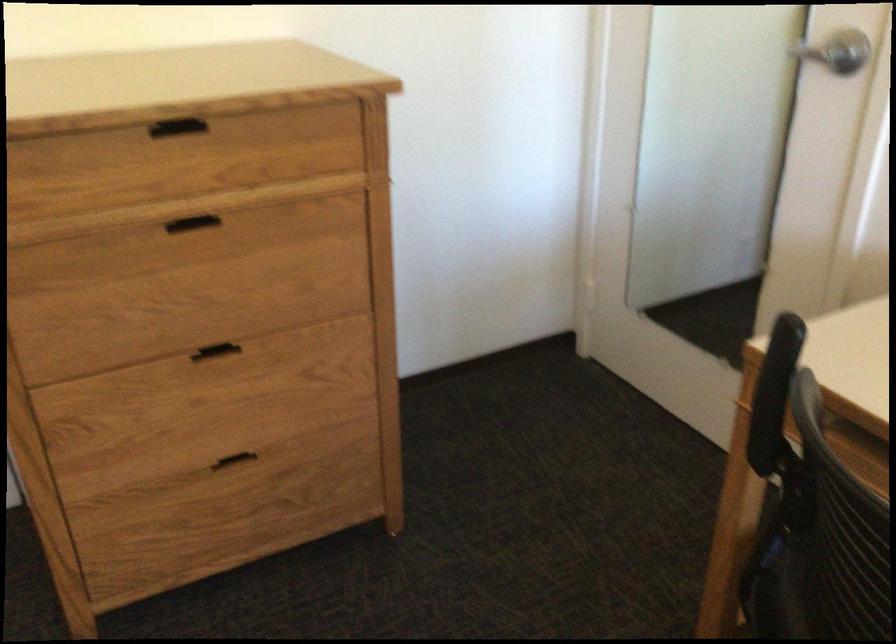
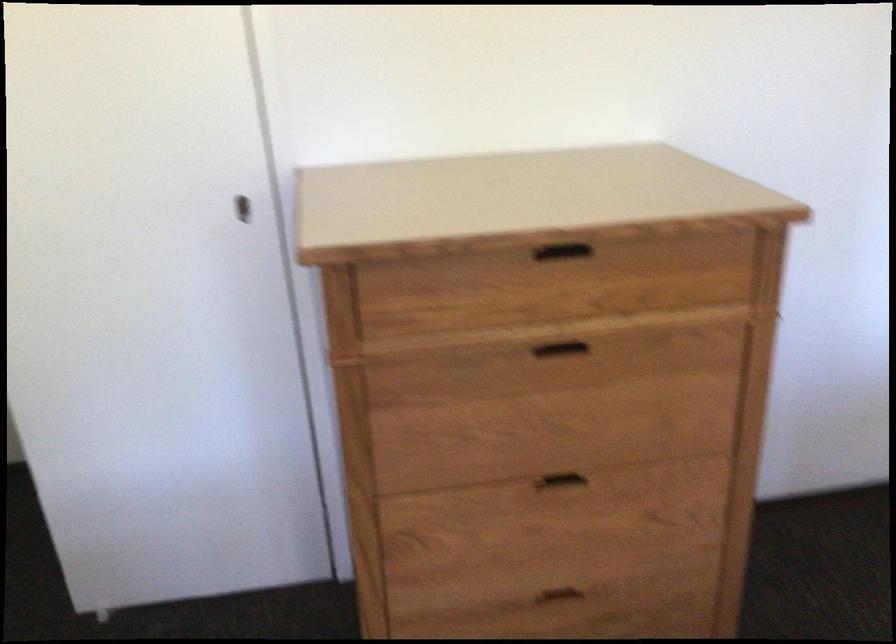
Based on the photo, in a continuous first-person perspective shot, in which direction is the camera moving?

The cameraman walked toward left, forward.